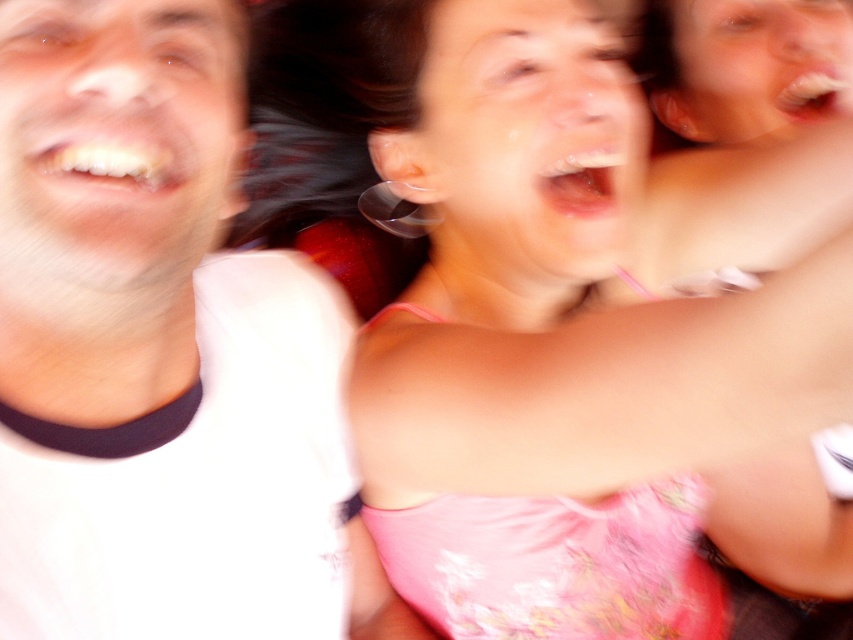
Is point (230, 538) behind point (440, 449)?

No, it is in front of (440, 449).

Does white matte t-shirt at left have a larger size compared to pink satin dress at upper center?

No.

Which is behind, point (108, 364) or point (608, 264)?

Point (608, 264)

The height and width of the screenshot is (640, 853). Identify the location of white matte t-shirt at left. (161, 353).